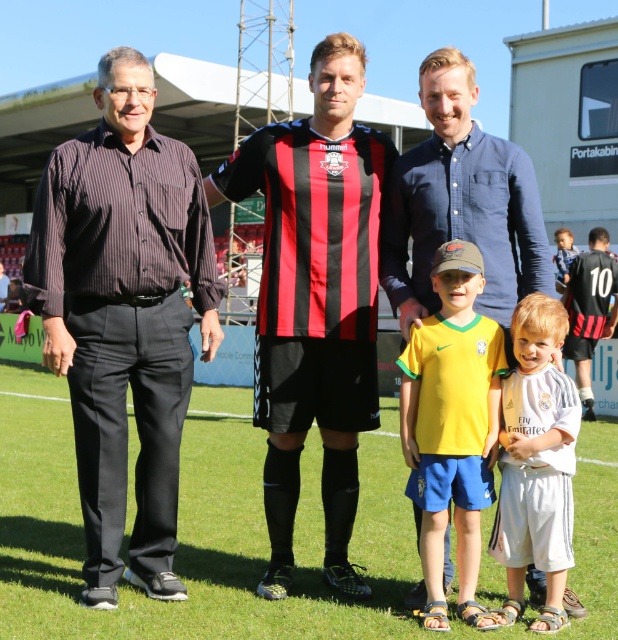
Between red and black striped jersey at center and black jersey at right, which one appears on the right side from the viewer's perspective?

black jersey at right is more to the right.

Does red and black striped jersey at center have a greater width compared to black jersey at right?

Yes.

Is point (355, 342) closer to viewer compared to point (616, 269)?

Yes, it is.

Identify the location of red and black striped jersey at center. (315, 300).

Can you confirm if white cotton shirt at center is wider than black jersey at right?

Incorrect, white cotton shirt at center's width does not surpass black jersey at right's.

What do you see at coordinates (536, 461) in the screenshot? Image resolution: width=618 pixels, height=640 pixels. I see `white cotton shirt at center` at bounding box center [536, 461].

At what (x,y) coordinates should I click in order to perform the action: click on white cotton shirt at center. Please return your answer as a coordinate pair (x, y). Looking at the image, I should click on (536, 461).

Between point (527, 179) and point (433, 456), which one is positioned behind?

The point (527, 179) is more distant.

Can you confirm if blue cotton shirt at center is taller than yellow jersey at center?

Incorrect, blue cotton shirt at center's height is not larger of yellow jersey at center's.

Is point (504, 282) farther from viewer compared to point (431, 316)?

Yes, it is behind point (431, 316).

Image resolution: width=618 pixels, height=640 pixels. Identify the location of blue cotton shirt at center. (462, 204).